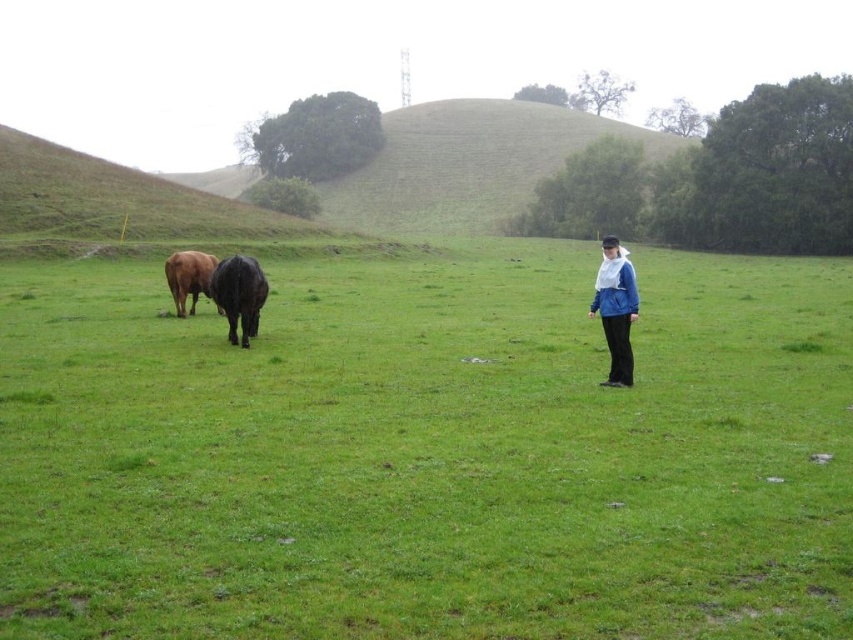
You are standing at the point labeled as point [428,452] in the image. Based on the scene description, what do you see around you?

The point [428,452] corresponds to the green grassy field at center, so you are standing in the middle of the grassy field surrounded by the two cows grazing nearby and the person observing in the midground.

You are standing at the point with coordinates point (601, 384) and want to walk to the point with coordinates point (372, 524). Which direction should you move relative to the cows?

You should move towards the cows because point (372, 524) is in front of point (601, 384), meaning it is closer to the cows.